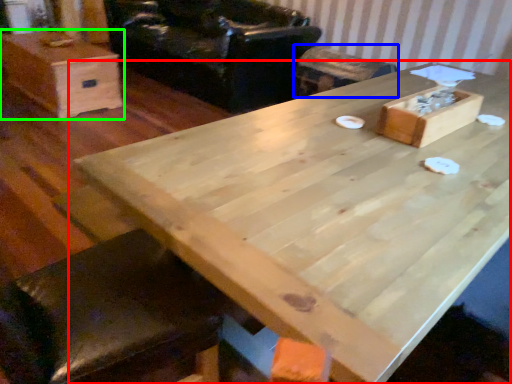
Question: Based on their relative distances, which object is nearer to table (highlighted by a red box)? Choose from bar stool (highlighted by a blue box) and box (highlighted by a green box).

Choices:
 (A) bar stool
 (B) box

Answer: (A)